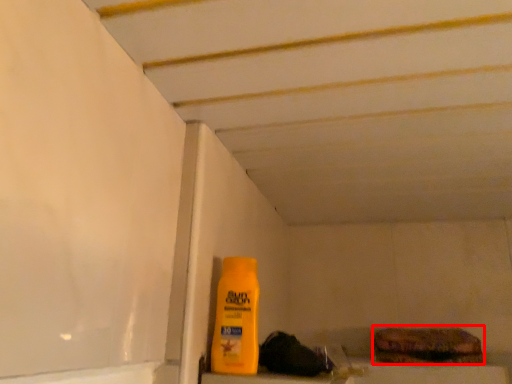
Question: Considering the relative positions of food (annotated by the red box) and bottle in the image provided, where is food (annotated by the red box) located with respect to the staircase?

Choices:
 (A) left
 (B) right

Answer: (B)